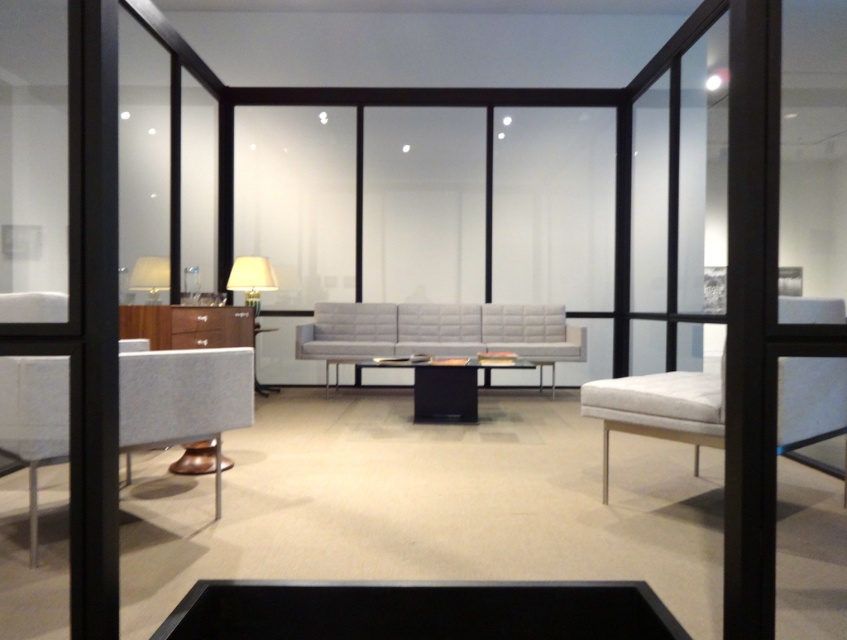
You are standing in the living room and want to move from the white fabric armchair at right to the light gray quilted fabric couch at center. Which direction should you move to get closer to the couch?

Since the white fabric armchair at right is closer to the viewer than the light gray quilted fabric couch at center, you should move towards the couch by going away from the viewer to reach it.

You are a guest entering the living room and want to sit down. Which object, the textured gray chair at left or the matte white lampshade at upper left, is suitable for sitting?

The textured gray chair at left is suitable for sitting because it is taller than the matte white lampshade at upper left, indicating it has a seat height appropriate for sitting.